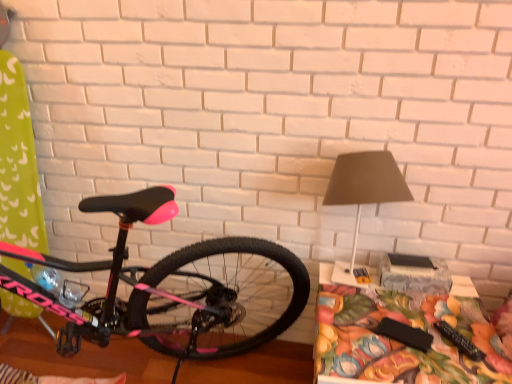
The height and width of the screenshot is (384, 512). Find the location of `empty space that is to the right of matte gray lampshade at upper right`. empty space that is to the right of matte gray lampshade at upper right is located at coordinates (439, 306).